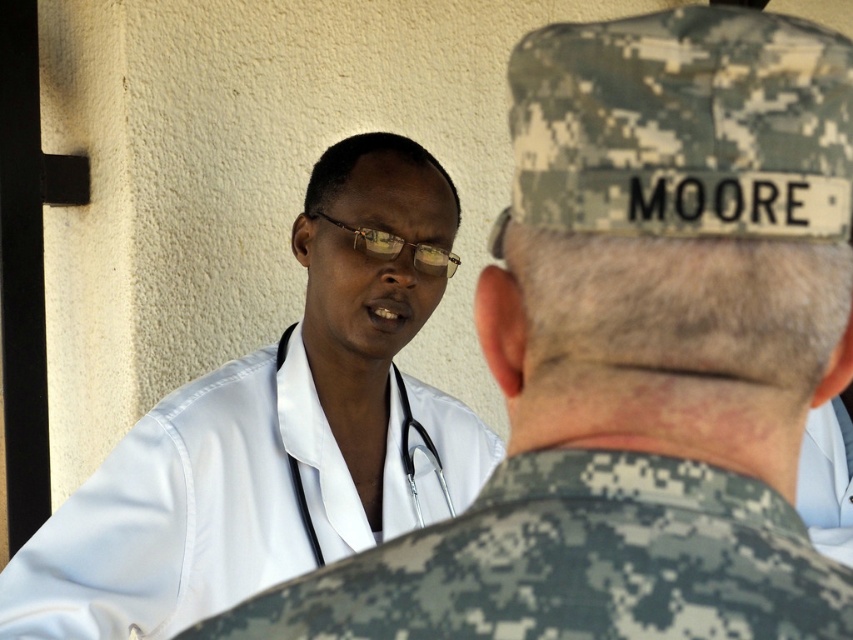
You are a photographer trying to capture a closeup of the metallic silver stethoscope at center without including the digital camouflage uniform at center in the frame. Based on their positions, is this possible?

The digital camouflage uniform at center is located above the metallic silver stethoscope at center, so it is possible to capture a closeup of the metallic silver stethoscope at center without including the digital camouflage uniform at center by focusing on the lower part of the frame.